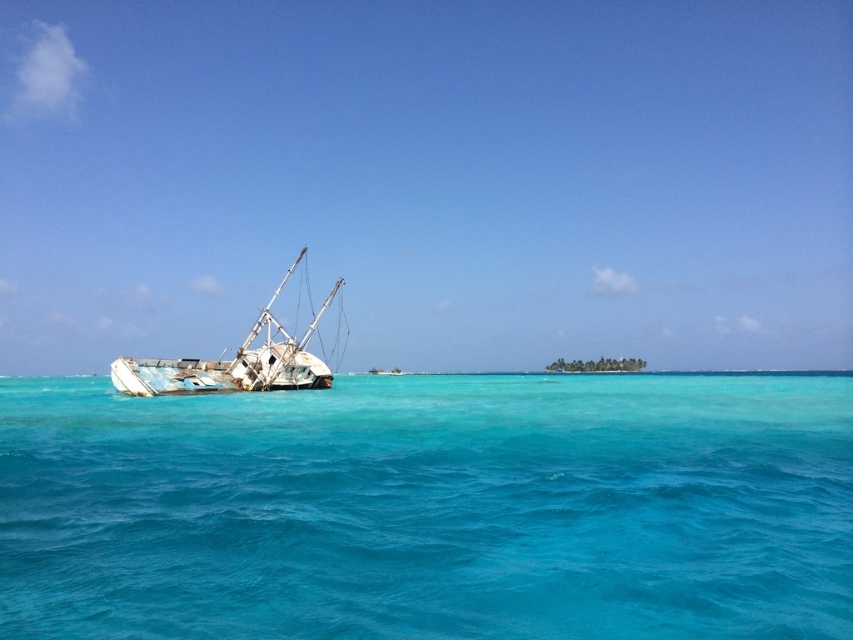
Question: Which point appears closest to the camera in this image?

Choices:
 (A) (198, 372)
 (B) (183, 509)

Answer: (B)

Question: Is clear blue water at left to the right of rusty metal boat at left from the viewer's perspective?

Choices:
 (A) no
 (B) yes

Answer: (B)

Question: Which point appears closest to the camera in this image?

Choices:
 (A) (112, 408)
 (B) (309, 365)

Answer: (A)

Question: Is clear blue water at left thinner than rusty metal boat at left?

Choices:
 (A) yes
 (B) no

Answer: (B)

Question: Can you confirm if clear blue water at left is bigger than rusty metal boat at left?

Choices:
 (A) yes
 (B) no

Answer: (A)